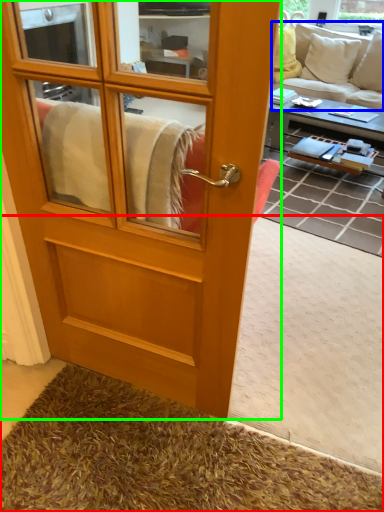
Question: Which object is positioned closest to carpets (highlighted by a red box)? Select from studio couch (highlighted by a blue box) and screen door (highlighted by a green box).

Choices:
 (A) studio couch
 (B) screen door

Answer: (B)